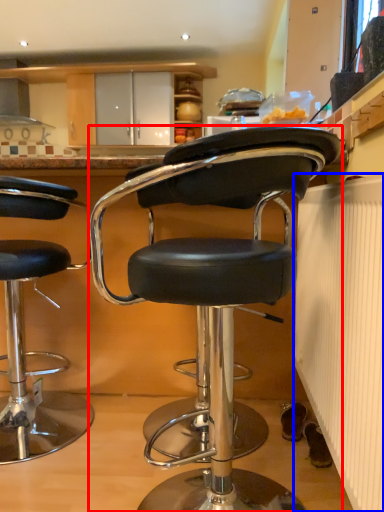
Question: Among these objects, which one is farthest to the camera, chair (highlighted by a red box) or radiator (highlighted by a blue box)?

Choices:
 (A) chair
 (B) radiator

Answer: (A)